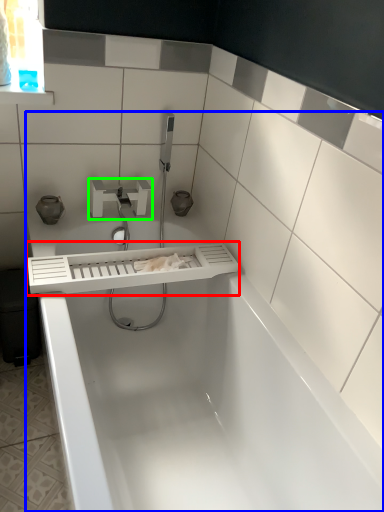
Question: Which object is positioned farthest from balustrade (highlighted by a red box)? Select from bathtub (highlighted by a blue box) and tap (highlighted by a green box).

Choices:
 (A) bathtub
 (B) tap

Answer: (B)